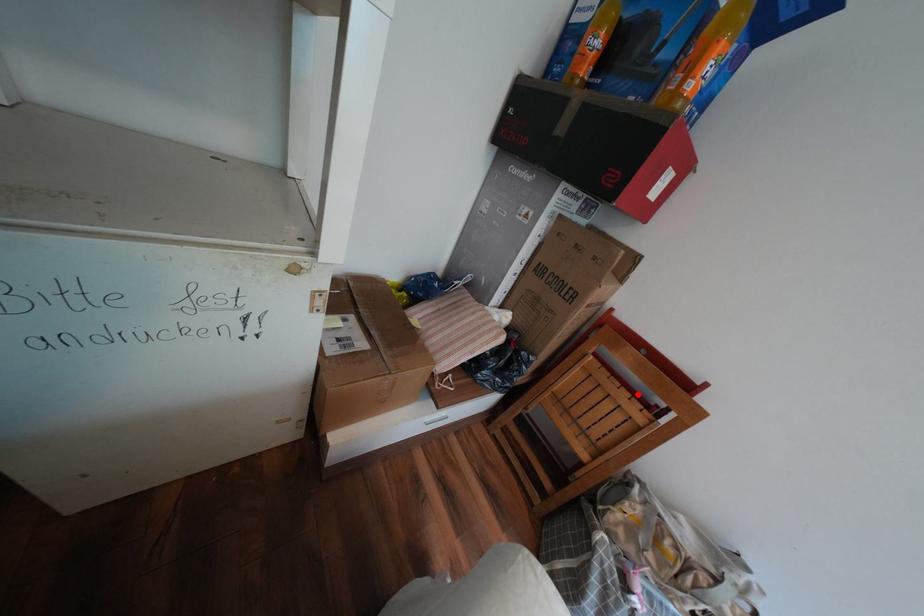
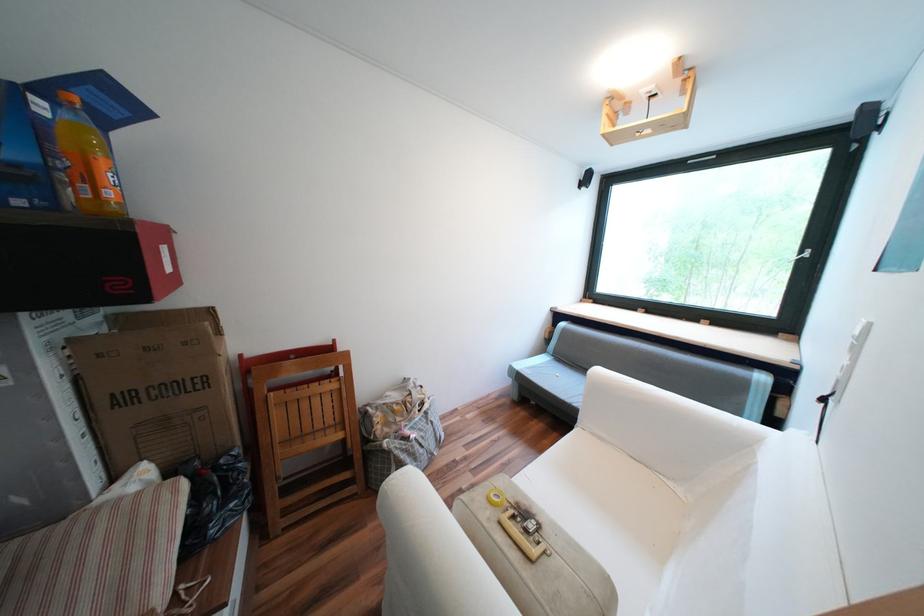
In the second image, find the point that corresponds to the highlighted location in the first image.

(325, 383)